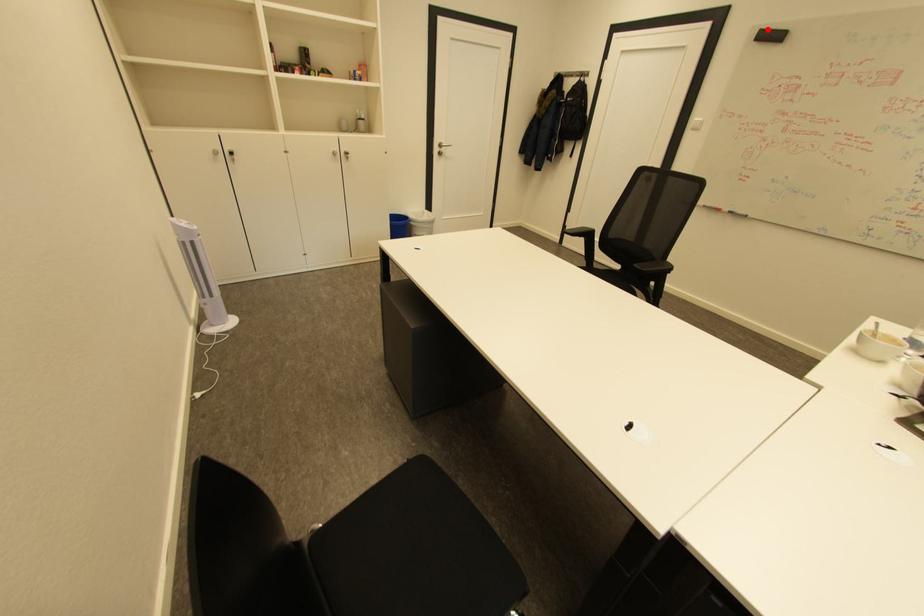
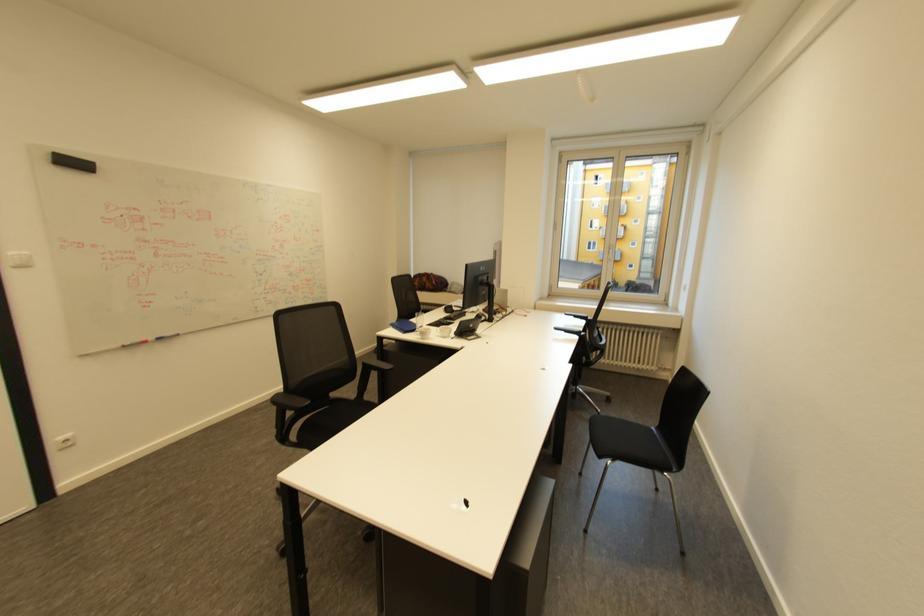
Locate, in the second image, the point that corresponds to the highlighted location in the first image.

(58, 153)